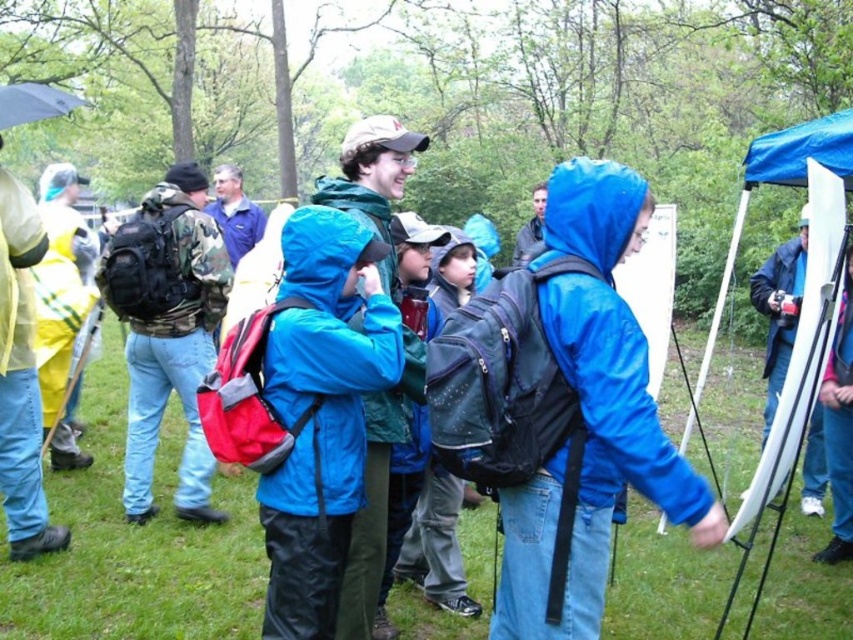
Question: Which point is farther from the camera taking this photo?

Choices:
 (A) (53, 548)
 (B) (827, 438)
 (C) (584, 316)

Answer: (B)

Question: Based on their relative distances, which object is farther from the matte black camera at right?

Choices:
 (A) matte blue jacket at center
 (B) yellow hazmat suit at left

Answer: (B)

Question: From the image, what is the correct spatial relationship of blue matte jacket at center in relation to matte black jacket at center?

Choices:
 (A) below
 (B) above

Answer: (A)

Question: Which point appears closest to the camera in this image?

Choices:
 (A) (4, 92)
 (B) (132, 225)

Answer: (A)

Question: From the image, what is the correct spatial relationship of camo fabric backpack at left in relation to yellow waterproof jacket at left?

Choices:
 (A) above
 (B) below

Answer: (B)

Question: Does camo fabric backpack at left have a lesser width compared to matte black jacket at center?

Choices:
 (A) no
 (B) yes

Answer: (A)